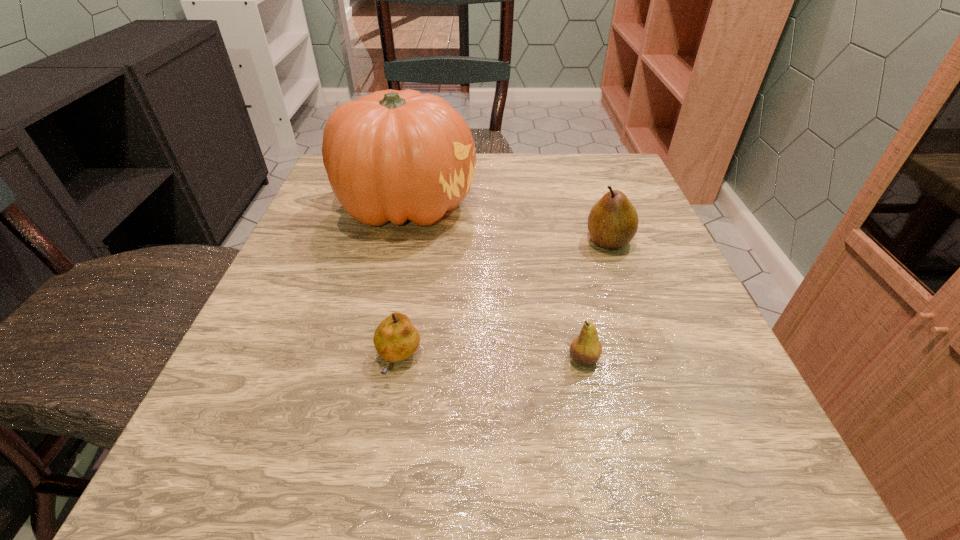
The height and width of the screenshot is (540, 960). I want to click on object present at the far edge, so click(392, 155).

Identify the location of object that is at the left edge. (392, 155).

Locate an element on the screen. The width and height of the screenshot is (960, 540). object located in the right edge section of the desktop is located at coordinates (613, 221).

At what (x,y) coordinates should I click in order to perform the action: click on object at the far left corner. Please return your answer as a coordinate pair (x, y). The width and height of the screenshot is (960, 540). Looking at the image, I should click on (392, 155).

In the image, there is a desktop. Where is `free region at the far edge`? Image resolution: width=960 pixels, height=540 pixels. free region at the far edge is located at coordinates (536, 189).

I want to click on vacant region at the near edge of the desktop, so pos(364,512).

Identify the location of vacant space at the left edge of the desktop. (336, 214).

You are a GUI agent. You are given a task and a screenshot of the screen. Output one action in this format:
    pyautogui.click(x=<x>, y=<y>)
    Task: Click on the vacant space at the right edge
    Image resolution: width=960 pixels, height=540 pixels.
    Given the screenshot: What is the action you would take?
    pyautogui.click(x=664, y=431)

The height and width of the screenshot is (540, 960). I want to click on vacant space at the far right corner of the desktop, so click(591, 190).

The height and width of the screenshot is (540, 960). Find the location of `vacant space at the near right corner`. vacant space at the near right corner is located at coordinates (707, 459).